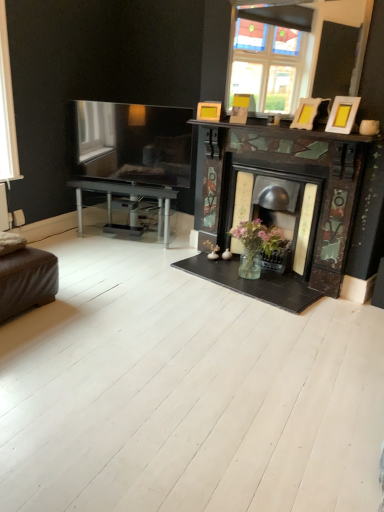
This screenshot has height=512, width=384. What are the coordinates of `wooden photo frame at upper right, which is the 2th picture frame from left to right` in the screenshot? It's located at (306, 113).

Describe the element at coordinates (342, 114) in the screenshot. The image size is (384, 512). I see `matte gold picture frame at upper right, marked as the first picture frame in a right-to-left arrangement` at that location.

What are the coordinates of `brown leather ottoman at lower left` in the screenshot? It's located at (23, 275).

Describe the element at coordinates (23, 275) in the screenshot. The height and width of the screenshot is (512, 384). I see `brown leather ottoman at lower left` at that location.

The height and width of the screenshot is (512, 384). Identify the location of matte yellow picture frame at upper right, acting as the 3th picture frame starting from the front. tap(240, 108).

Considering the positions of points (236, 106) and (3, 142), is point (236, 106) farther from camera compared to point (3, 142)?

Yes, point (236, 106) is farther from viewer.

From the picture: Which object is positioned more to the left, matte yellow picture frame at upper right, positioned as the first picture frame in back-to-front order, or transparent glass window at left?

transparent glass window at left.

Looking at this image, is transparent glass window at left at the back of matte yellow picture frame at upper right, marked as the 1th picture frame in a left-to-right arrangement?

No, matte yellow picture frame at upper right, marked as the 1th picture frame in a left-to-right arrangement, is not facing away from transparent glass window at left.

Is matte yellow picture frame at upper right, acting as the 3th picture frame starting from the front, wider or thinner than transparent glass window at left?

matte yellow picture frame at upper right, acting as the 3th picture frame starting from the front, is wider than transparent glass window at left.

The image size is (384, 512). I want to click on the 2nd picture frame above the brown leather ottoman at lower left (from the image's perspective), so click(306, 113).

Could you tell me if wooden photo frame at upper right, positioned as the 2th picture frame in right-to-left order, is turned towards brown leather ottoman at lower left?

No, wooden photo frame at upper right, positioned as the 2th picture frame in right-to-left order, is not turned towards brown leather ottoman at lower left.

Can you tell me how much wooden photo frame at upper right, the 2th picture frame in the front-to-back sequence, and brown leather ottoman at lower left differ in facing direction?

They differ by 115 degrees in their facing directions.

Does point (309, 109) come behind point (51, 261)?

Yes, point (309, 109) is behind point (51, 261).

Would you say matte gold picture frame at upper right, which is counted as the third picture frame, starting from the back, is part of wooden photo frame at upper right, the 2th picture frame in the front-to-back sequence,'s contents?

No, wooden photo frame at upper right, the 2th picture frame in the front-to-back sequence, does not contain matte gold picture frame at upper right, which is counted as the third picture frame, starting from the back.

Considering the sizes of objects wooden photo frame at upper right, the 2th picture frame in the front-to-back sequence, and matte gold picture frame at upper right, marked as the first picture frame in a right-to-left arrangement, in the image provided, who is thinner, wooden photo frame at upper right, the 2th picture frame in the front-to-back sequence, or matte gold picture frame at upper right, marked as the first picture frame in a right-to-left arrangement,?

wooden photo frame at upper right, the 2th picture frame in the front-to-back sequence, is thinner.

Who is shorter, wooden photo frame at upper right, positioned as the 2th picture frame in right-to-left order, or matte gold picture frame at upper right, which is counted as the third picture frame, starting from the back?

Standing shorter between the two is wooden photo frame at upper right, positioned as the 2th picture frame in right-to-left order.

Looking at the image, does wooden photo frame at upper right, which is the 2th picture frame from left to right, seem bigger or smaller compared to matte gold picture frame at upper right, which is counted as the third picture frame, starting from the back?

Clearly, wooden photo frame at upper right, which is the 2th picture frame from left to right, is smaller in size than matte gold picture frame at upper right, which is counted as the third picture frame, starting from the back.

Is wooden photo frame at upper right, which is the 2th picture frame from left to right, taller or shorter than transparent glass window at left?

→ Considering their sizes, wooden photo frame at upper right, which is the 2th picture frame from left to right, has less height than transparent glass window at left.

Find the location of a particular element. The height and width of the screenshot is (512, 384). window on the left side of wooden photo frame at upper right, the 2th picture frame in the front-to-back sequence is located at coordinates (7, 109).

In the scene shown: From a real-world perspective, is wooden photo frame at upper right, the 2th picture frame in the front-to-back sequence, above or below transparent glass window at left?

Clearly, from a real-world perspective, wooden photo frame at upper right, the 2th picture frame in the front-to-back sequence, is below transparent glass window at left.

Which of these two, wooden photo frame at upper right, the 2th picture frame in the front-to-back sequence, or transparent glass window at left, is wider?

transparent glass window at left is wider.

How many degrees apart are the facing directions of matte gold picture frame at upper right, marked as the first picture frame in a right-to-left arrangement, and brown leather ottoman at lower left?

They differ by 115 degrees in their facing directions.

Between matte gold picture frame at upper right, which is the 1th picture frame in front-to-back order, and brown leather ottoman at lower left, which one has larger size?

brown leather ottoman at lower left is bigger.

Is point (348, 122) more distant than point (15, 239)?

No, it is not.

Which object is closer to the camera, matte gold picture frame at upper right, which is counted as the third picture frame, starting from the back, or brown leather ottoman at lower left?

brown leather ottoman at lower left is closer to the camera.

Does point (5, 291) appear closer or farther from the camera than point (249, 103)?

Point (5, 291) is closer to the camera than point (249, 103).

From the picture: Could matte yellow picture frame at upper right, acting as the 3th picture frame starting from the front, be considered to be inside brown leather ottoman at lower left?

Actually, matte yellow picture frame at upper right, acting as the 3th picture frame starting from the front, is outside brown leather ottoman at lower left.

Is brown leather ottoman at lower left facing towards matte yellow picture frame at upper right, which is the 3th picture frame in right-to-left order?

No, brown leather ottoman at lower left is not turned towards matte yellow picture frame at upper right, which is the 3th picture frame in right-to-left order.

From the image's perspective, which is above, brown leather ottoman at lower left or matte yellow picture frame at upper right, marked as the 1th picture frame in a left-to-right arrangement?

matte yellow picture frame at upper right, marked as the 1th picture frame in a left-to-right arrangement, from the image's perspective.

Is matte gold picture frame at upper right, which is counted as the third picture frame, starting from the back, facing away from transparent glass window at left?

matte gold picture frame at upper right, which is counted as the third picture frame, starting from the back, is not turned away from transparent glass window at left.

Is matte gold picture frame at upper right, marked as the first picture frame in a right-to-left arrangement, inside or outside of transparent glass window at left?

matte gold picture frame at upper right, marked as the first picture frame in a right-to-left arrangement, exists outside the volume of transparent glass window at left.

Consider the image. Is there a large distance between matte gold picture frame at upper right, which is counted as the third picture frame, starting from the back, and transparent glass window at left?

Yes, matte gold picture frame at upper right, which is counted as the third picture frame, starting from the back, and transparent glass window at left are located far from each other.

From a real-world perspective, between matte gold picture frame at upper right, marked as the first picture frame in a right-to-left arrangement, and transparent glass window at left, who is vertically lower?

From a 3D spatial view, matte gold picture frame at upper right, marked as the first picture frame in a right-to-left arrangement, is below.

Which picture frame is the 1st one when counting from the right side of the transparent glass window at left? Please provide its 2D coordinates.

[(240, 108)]

Find the location of a particular element. couch on the left of wooden photo frame at upper right, positioned as the 2th picture frame in back-to-front order is located at coordinates (23, 275).

Looking at the image, which one is located closer to matte yellow picture frame at upper right, positioned as the first picture frame in back-to-front order, wooden photo frame at upper right, which is the 2th picture frame from left to right, or brown leather ottoman at lower left?

wooden photo frame at upper right, which is the 2th picture frame from left to right, lies closer to matte yellow picture frame at upper right, positioned as the first picture frame in back-to-front order, than the other object.

Which object lies nearer to the anchor point transparent glass window at left, wooden photo frame at upper right, positioned as the 2th picture frame in back-to-front order, or brown leather ottoman at lower left?

brown leather ottoman at lower left lies closer to transparent glass window at left than the other object.

Estimate the real-world distances between objects in this image. Which object is further from wooden photo frame at upper right, positioned as the 2th picture frame in back-to-front order, matte yellow picture frame at upper right, acting as the 3th picture frame starting from the front, or matte gold picture frame at upper right, which appears as the third picture frame when viewed from the left?

matte yellow picture frame at upper right, acting as the 3th picture frame starting from the front, is further to wooden photo frame at upper right, positioned as the 2th picture frame in back-to-front order.

Which object lies nearer to the anchor point transparent glass window at left, brown leather ottoman at lower left or wooden photo frame at upper right, the 2th picture frame in the front-to-back sequence?

The object closer to transparent glass window at left is brown leather ottoman at lower left.

Which object lies further to the anchor point matte gold picture frame at upper right, which appears as the third picture frame when viewed from the left, matte yellow picture frame at upper right, positioned as the first picture frame in back-to-front order, or brown leather ottoman at lower left?

brown leather ottoman at lower left is positioned further to the anchor matte gold picture frame at upper right, which appears as the third picture frame when viewed from the left.

Estimate the real-world distances between objects in this image. Which object is further from matte yellow picture frame at upper right, which is the 3th picture frame in right-to-left order, brown leather ottoman at lower left or wooden photo frame at upper right, the 2th picture frame in the front-to-back sequence?

Among the two, brown leather ottoman at lower left is located further to matte yellow picture frame at upper right, which is the 3th picture frame in right-to-left order.

From the image, which object appears to be farther from matte gold picture frame at upper right, which is counted as the third picture frame, starting from the back, transparent glass window at left or matte yellow picture frame at upper right, marked as the 1th picture frame in a left-to-right arrangement?

Among the two, transparent glass window at left is located further to matte gold picture frame at upper right, which is counted as the third picture frame, starting from the back.

Looking at the image, which one is located further to matte yellow picture frame at upper right, marked as the 1th picture frame in a left-to-right arrangement, brown leather ottoman at lower left or matte gold picture frame at upper right, which appears as the third picture frame when viewed from the left?

brown leather ottoman at lower left is positioned further to the anchor matte yellow picture frame at upper right, marked as the 1th picture frame in a left-to-right arrangement.

Locate an element on the screen. picture frame between transparent glass window at left and wooden photo frame at upper right, positioned as the 2th picture frame in right-to-left order is located at coordinates (240, 108).

The height and width of the screenshot is (512, 384). In order to click on couch between transparent glass window at left and matte yellow picture frame at upper right, acting as the 3th picture frame starting from the front, in the horizontal direction in this screenshot , I will do `click(23, 275)`.

Identify the location of couch between transparent glass window at left and matte gold picture frame at upper right, marked as the first picture frame in a right-to-left arrangement, from left to right. (23, 275).

The height and width of the screenshot is (512, 384). Identify the location of picture frame situated between brown leather ottoman at lower left and wooden photo frame at upper right, the 2th picture frame in the front-to-back sequence, from left to right. (240, 108).